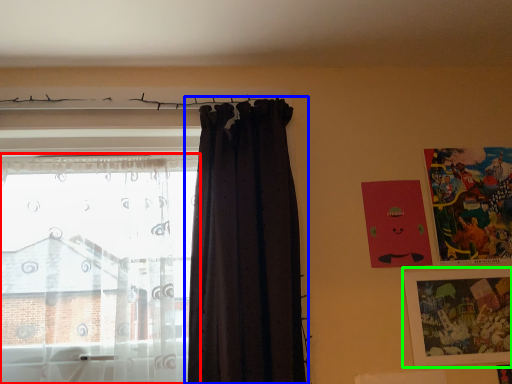
Question: Based on their relative distances, which object is farther from curtain (highlighted by a red box)? Choose from curtain (highlighted by a blue box) and picture frame (highlighted by a green box).

Choices:
 (A) curtain
 (B) picture frame

Answer: (B)